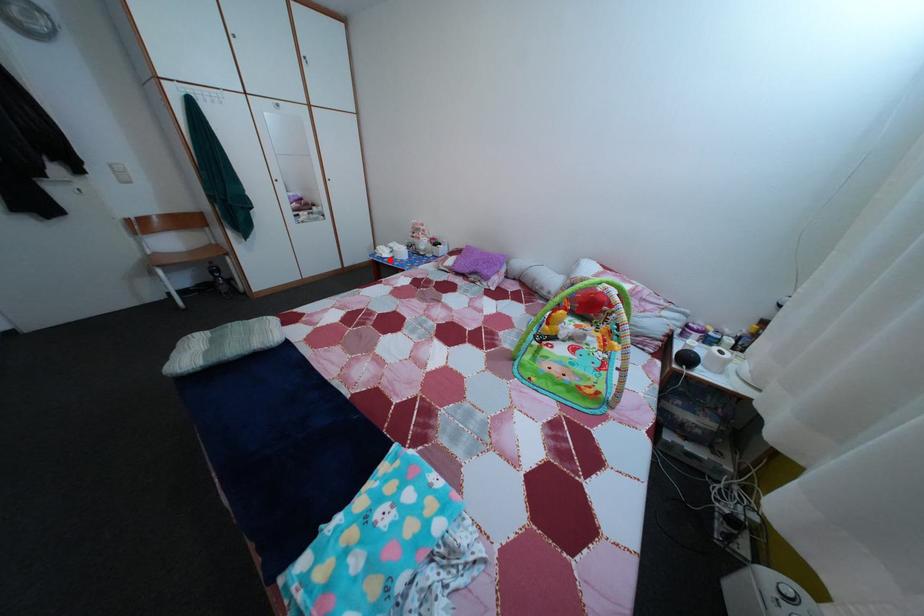
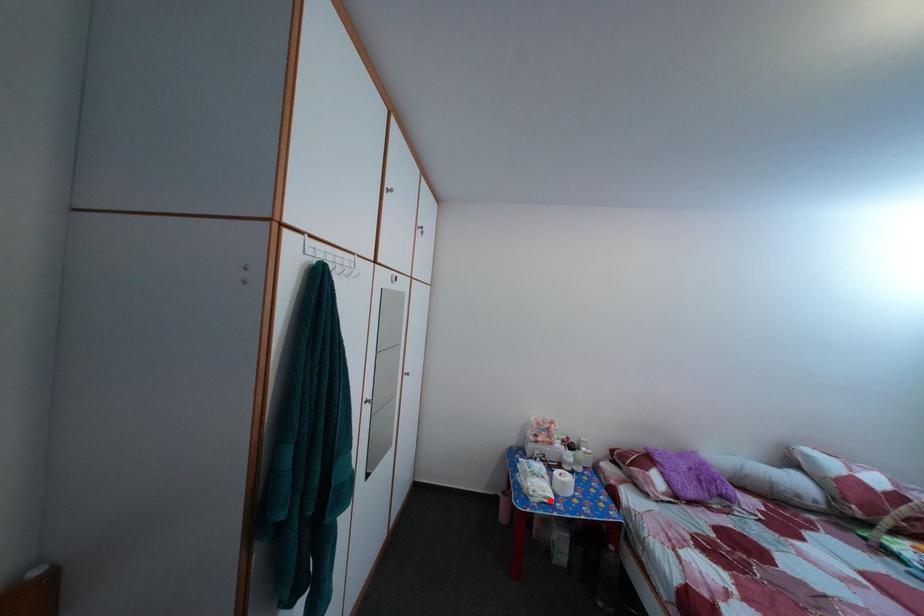
I am providing you with two images of the same scene from different viewpoints. A red point is marked on the first image and another point is marked on the second image. Does the point marked in image1 correspond to the same location as the one in image2?

Yes